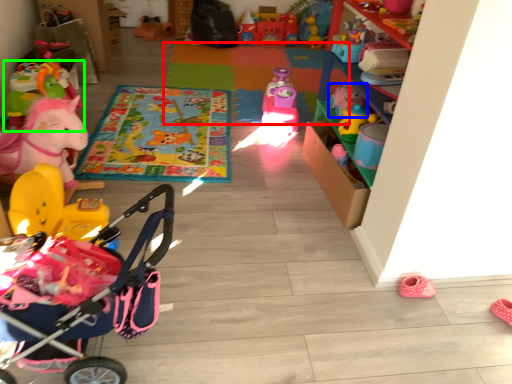
Question: Which object is positioned farthest from mat (highlighted by a red box)? Select from toy (highlighted by a blue box) and toy (highlighted by a green box).

Choices:
 (A) toy
 (B) toy

Answer: (B)